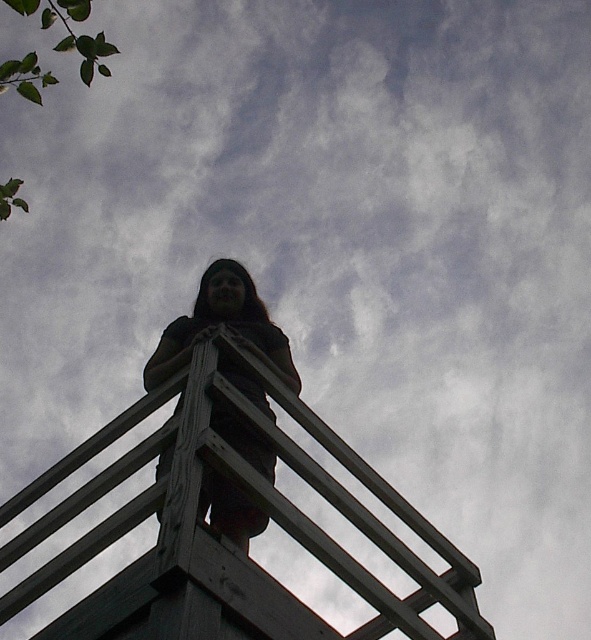
Is point (345, 460) positioned behind point (238, 342)?

Yes, it is.

Does wooden rail at center come behind dark brown leather jacket at center?

No.

Is point (56, 584) farther from viewer compared to point (249, 531)?

No, (56, 584) is closer to viewer.

Find the location of a particular element. Image resolution: width=591 pixels, height=640 pixels. wooden rail at center is located at coordinates (228, 540).